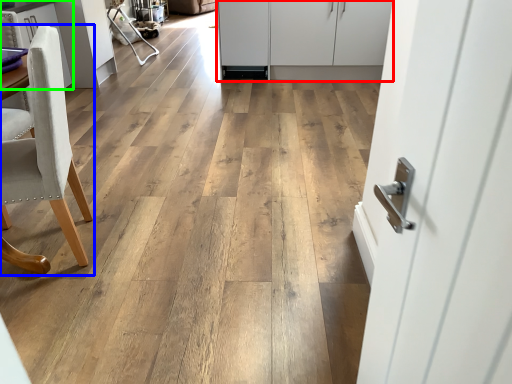
Question: Based on their relative distances, which object is nearer to cabinetry (highlighted by a red box)? Choose from chair (highlighted by a blue box) and cabinetry (highlighted by a green box).

Choices:
 (A) chair
 (B) cabinetry

Answer: (B)